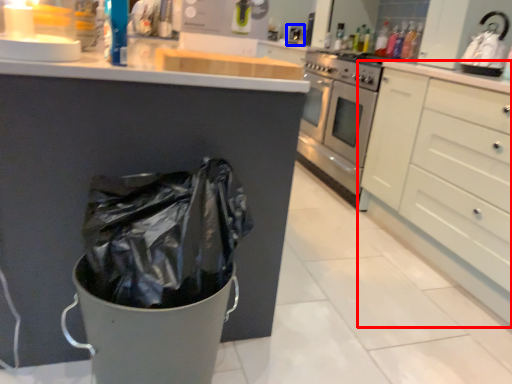
Question: Which object is closer to the camera taking this photo, cabinetry (highlighted by a red box) or sink (highlighted by a blue box)?

Choices:
 (A) cabinetry
 (B) sink

Answer: (A)